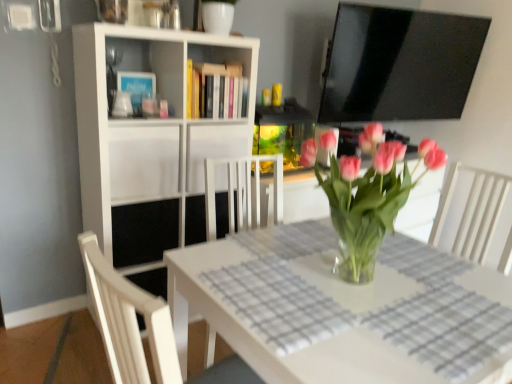
Question: From the image's perspective, is white matte cabinet at center, the second cabinet positioned from the right, positioned above or below hardcover books at upper center?

Choices:
 (A) above
 (B) below

Answer: (B)

Question: Considering the positions of white matte cabinet at center, the 1th cabinet when ordered from left to right, and hardcover books at upper center in the image, is white matte cabinet at center, the 1th cabinet when ordered from left to right, taller or shorter than hardcover books at upper center?

Choices:
 (A) short
 (B) tall

Answer: (B)

Question: Estimate the real-world distances between objects in this image. Which object is closer to the clear glass table at center?

Choices:
 (A) white matte cabinet at center, marked as the second cabinet in a left-to-right arrangement
 (B) white matte bookshelf at upper left, which appears as the second shelf when ordered from the bottom
 (C) pink glass vase at center
 (D) white matte cabinet at center, the 1th cabinet when ordered from left to right
 (E) hardcover books at upper center

Answer: (C)

Question: Which object is positioned farthest from the white matte cabinet at center, the second cabinet positioned from the right?

Choices:
 (A) pink glass vase at center
 (B) clear glass table at center
 (C) hardcover books at upper center
 (D) white matte bookshelf at upper left, the first shelf in the top-to-bottom sequence
 (E) black matte shelf at center, which is the 1th shelf in bottom-to-top order

Answer: (A)